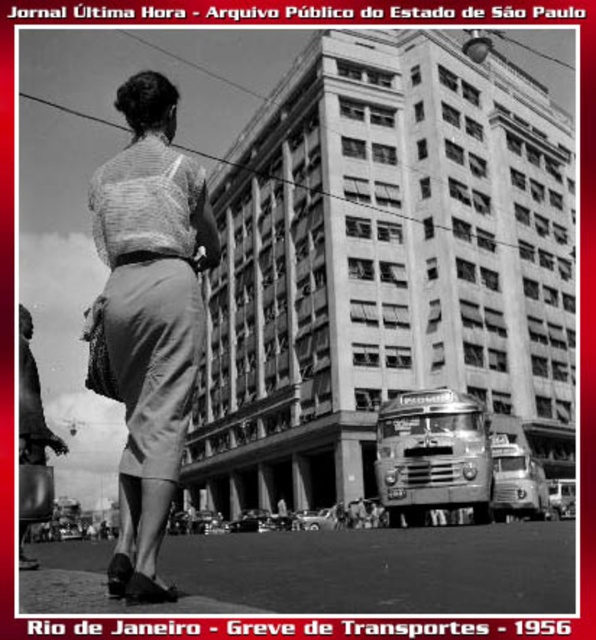
Question: Among these objects, which one is nearest to the camera?

Choices:
 (A) matte gray skirt at lower left
 (B) matte gray skirt at center

Answer: (B)

Question: Which point is closer to the camera?

Choices:
 (A) (151, 356)
 (B) (20, 385)

Answer: (A)

Question: Which point is farther to the camera?

Choices:
 (A) matte gray skirt at center
 (B) matte gray skirt at lower left

Answer: (B)

Question: Can you confirm if matte gray skirt at center is positioned below matte gray skirt at lower left?

Choices:
 (A) no
 (B) yes

Answer: (A)

Question: Is matte gray skirt at center thinner than matte gray skirt at lower left?

Choices:
 (A) yes
 (B) no

Answer: (B)

Question: Can you confirm if matte gray skirt at center is thinner than matte gray skirt at lower left?

Choices:
 (A) no
 (B) yes

Answer: (A)